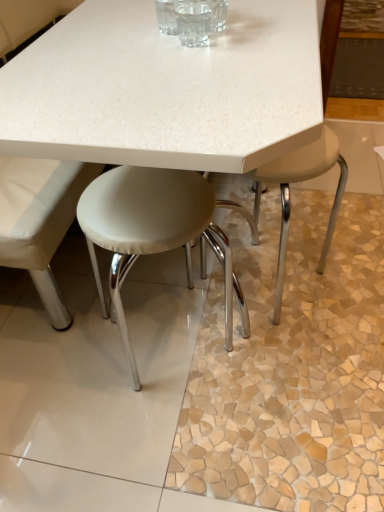
Question: From the image's perspective, is transparent glass at center located beneath beige leather stool at lower right, arranged as the first stool when viewed from the right?

Choices:
 (A) yes
 (B) no

Answer: (B)

Question: Is transparent glass at center closer to the viewer compared to beige leather stool at lower right, arranged as the first stool when viewed from the right?

Choices:
 (A) yes
 (B) no

Answer: (A)

Question: Would you say transparent glass at center is a long distance from beige leather stool at lower right, arranged as the first stool when viewed from the right?

Choices:
 (A) yes
 (B) no

Answer: (B)

Question: Considering the relative sizes of transparent glass at center and beige leather stool at lower right, arranged as the first stool when viewed from the right, in the image provided, is transparent glass at center taller than beige leather stool at lower right, arranged as the first stool when viewed from the right,?

Choices:
 (A) yes
 (B) no

Answer: (B)

Question: Is transparent glass at center oriented towards beige leather stool at lower right, arranged as the first stool when viewed from the right?

Choices:
 (A) no
 (B) yes

Answer: (A)

Question: Is transparent glass at center thinner than beige leather stool at lower right, acting as the second stool starting from the left?

Choices:
 (A) yes
 (B) no

Answer: (A)

Question: From a real-world perspective, is white leather stool at center, which is the 1th stool in left-to-right order, physically above beige leather stool at lower right, arranged as the first stool when viewed from the right?

Choices:
 (A) no
 (B) yes

Answer: (B)

Question: Is white leather stool at center, marked as the 2th stool in a right-to-left arrangement, turned away from beige leather stool at lower right, acting as the second stool starting from the left?

Choices:
 (A) no
 (B) yes

Answer: (A)

Question: Are white leather stool at center, marked as the 2th stool in a right-to-left arrangement, and beige leather stool at lower right, acting as the second stool starting from the left, far apart?

Choices:
 (A) no
 (B) yes

Answer: (A)

Question: Does white leather stool at center, marked as the 2th stool in a right-to-left arrangement, lie in front of beige leather stool at lower right, arranged as the first stool when viewed from the right?

Choices:
 (A) no
 (B) yes

Answer: (B)

Question: From a real-world perspective, is white leather stool at center, which is the 1th stool in left-to-right order, under beige leather stool at lower right, acting as the second stool starting from the left?

Choices:
 (A) no
 (B) yes

Answer: (A)

Question: From the image's perspective, is white leather stool at center, marked as the 2th stool in a right-to-left arrangement, below beige leather stool at lower right, acting as the second stool starting from the left?

Choices:
 (A) no
 (B) yes

Answer: (B)

Question: Would you say transparent glass at center is outside white leather stool at center, marked as the 2th stool in a right-to-left arrangement?

Choices:
 (A) yes
 (B) no

Answer: (A)